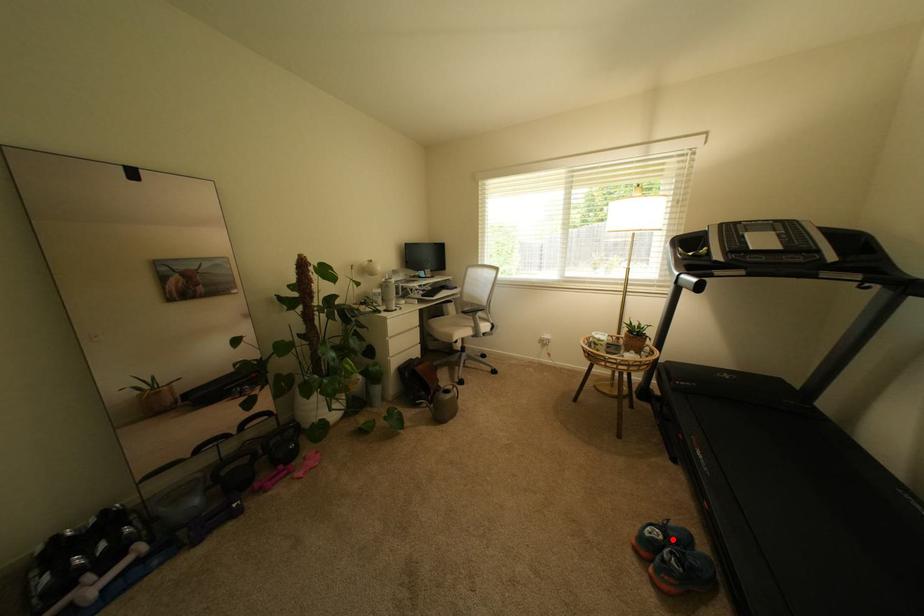
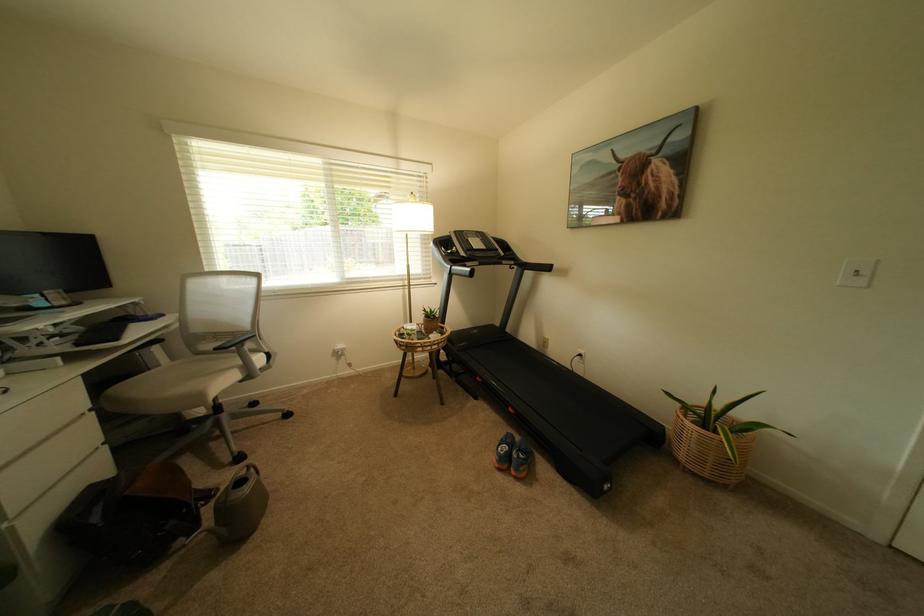
Question: I am providing you with two images of the same scene from different viewpoints. A red point is shown in image1. For the corresponding object point in image2, is it positioned nearer or farther from the camera?

Choices:
 (A) Nearer
 (B) Farther

Answer: (A)